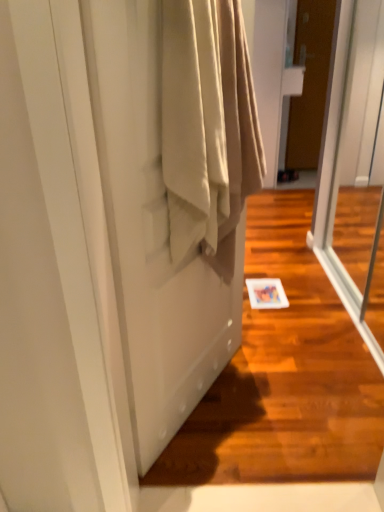
Where is `vacant area to the right of satin beige curtain at lower left, the 1th screen door from the left`? vacant area to the right of satin beige curtain at lower left, the 1th screen door from the left is located at coordinates (289, 396).